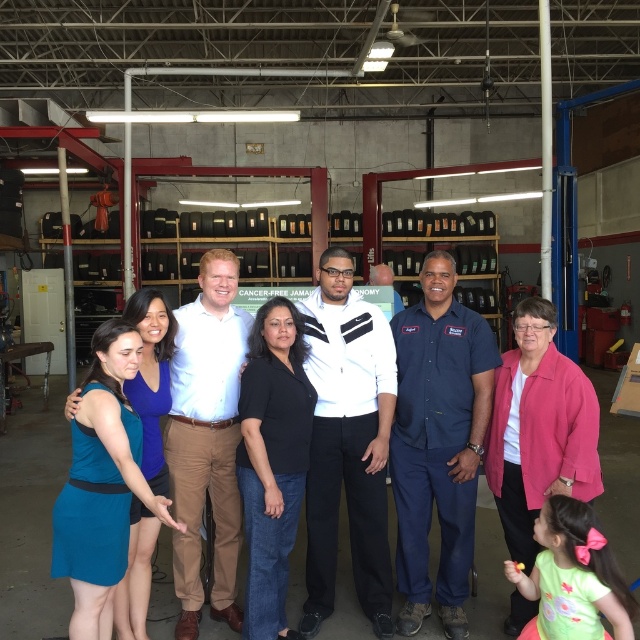
You are an employee in the tire shop and need to locate two specific items for a customer. The items are placed near the dark blue uniform at center and the white matte jacket at center. Since both items are on different levels, which item is closer to the floor?

The dark blue uniform at center is located below the white matte jacket at center, so the item near the dark blue uniform at center is closer to the floor.

You are standing in the tire shop and need to find the person wearing the dark blue uniform at center. According to the coordinates provided, where should you look to locate this individual?

The dark blue uniform at center is located at coordinates point (438,442), so you should look towards the center area of the image where those coordinates point to find the individual wearing the dark blue uniform at center.

You are a photographer trying to capture a group photo of the white matte jacket at center and the white cotton shirt at center. Since you want to ensure both subjects are fully visible in the frame, which subject requires a wider angle to accommodate their clothing?

The white matte jacket at center requires a wider angle because its width surpasses that of the white cotton shirt at center.